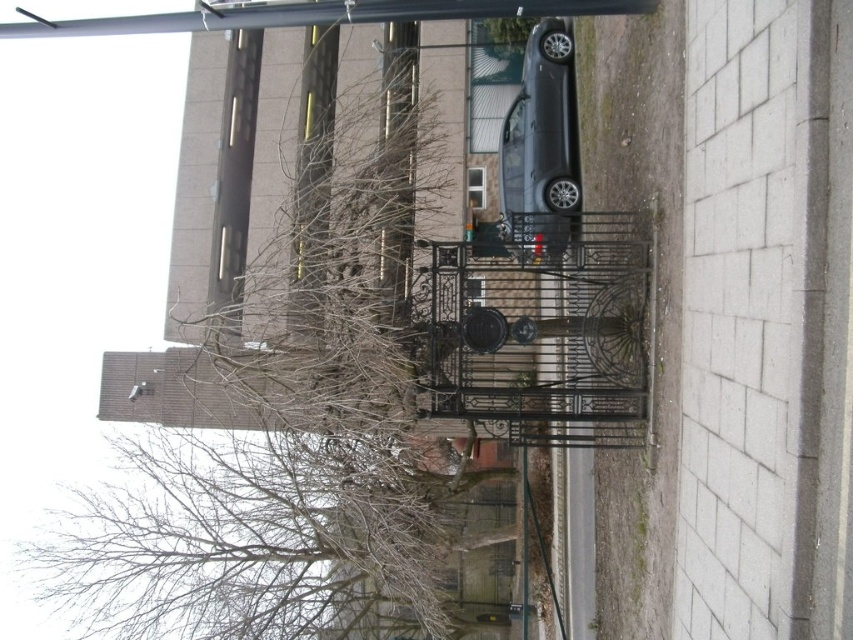
You are standing on the sidewalk in front of the black wrought iron gate at center. You want to walk through the gate to the property behind it. Is the gate open enough for you to pass through?

The black wrought iron gate at center is partially open, so yes, you can pass through it.

You are standing on the sidewalk and want to take a photo of both the black wrought iron gate at center and the satin black car at center. Which object should you focus on first to ensure both are in sharp focus?

The black wrought iron gate at center is closer to the viewer than the satin black car at center. To ensure both are in sharp focus, you should focus on the black wrought iron gate at center first, as it is the closer object.

You are a delivery person approaching the property. You need to determine if the black wrought iron gate at center can be opened without moving the satin black car at center. Based on their positions, is this possible?

The black wrought iron gate at center is positioned under the satin black car at center, meaning the car is blocking the gate. Therefore, you must move the satin black car at center to access and open the black wrought iron gate at center.